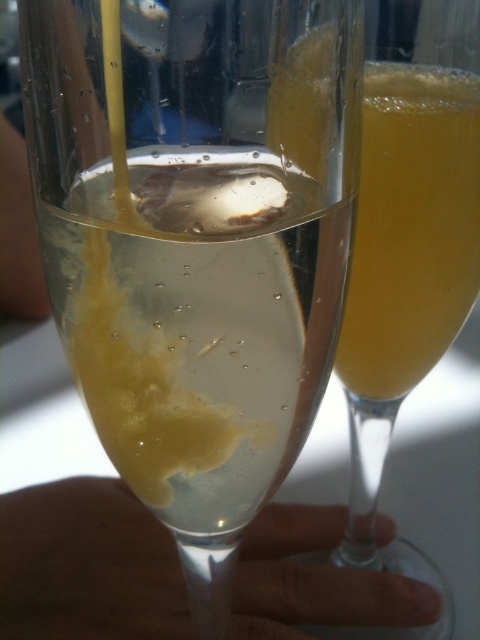
Question: Among these points, which one is nearest to the camera?

Choices:
 (A) (408, 305)
 (B) (298, 291)

Answer: (B)

Question: Is clear glass at center above translucent yellow liquid at center?

Choices:
 (A) no
 (B) yes

Answer: (A)

Question: Can you confirm if clear glass at center is smaller than translucent yellow liquid at center?

Choices:
 (A) yes
 (B) no

Answer: (A)

Question: Which point appears closest to the camera in this image?

Choices:
 (A) (231, 244)
 (B) (397, 80)

Answer: (A)

Question: Is clear glass at center behind translucent yellow liquid at center?

Choices:
 (A) no
 (B) yes

Answer: (A)